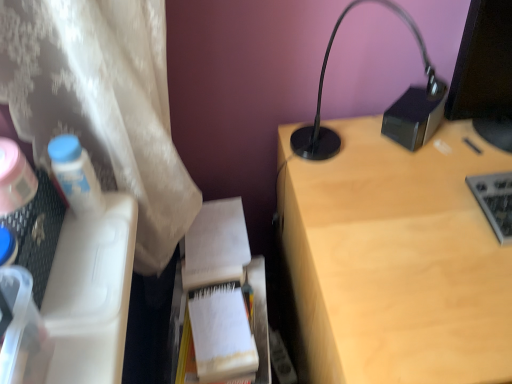
You are a GUI agent. You are given a task and a screenshot of the screen. Output one action in this format:
    pyautogui.click(x=<x>, y=<y>)
    Task: Click on the vacant space in front of black matte speaker at upper right
    
    Given the screenshot: What is the action you would take?
    pos(420,174)